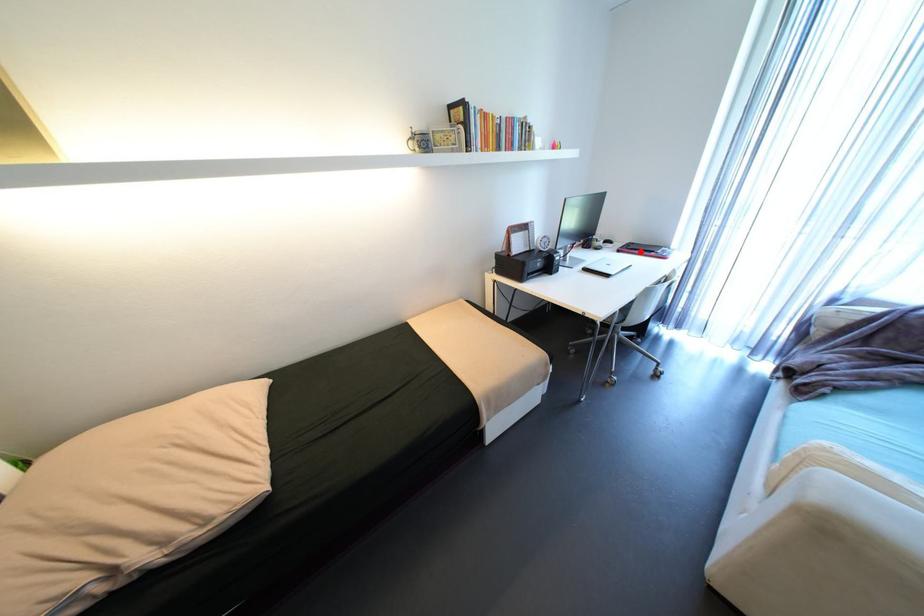
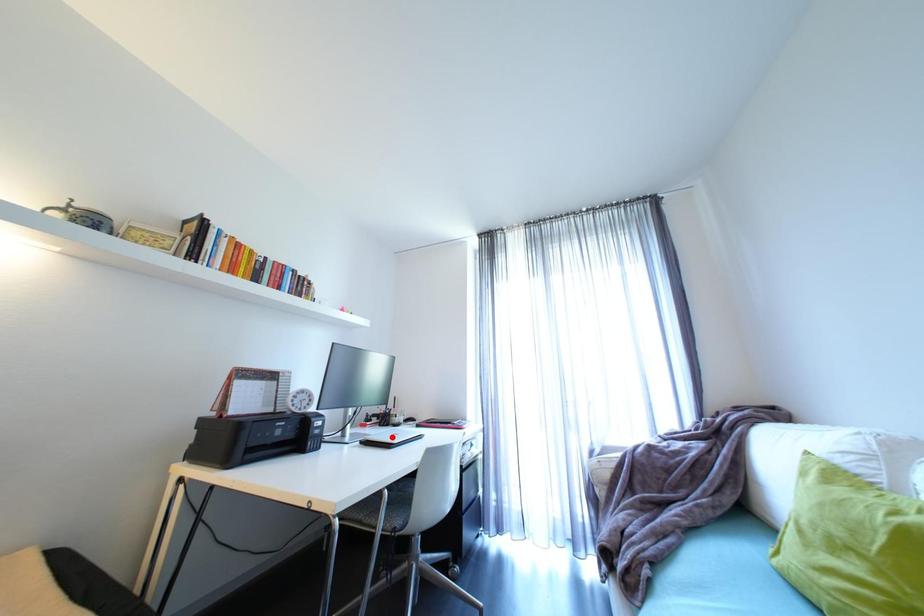
I am providing you with two images of the same scene from different viewpoints. A red point is marked on the first image and another point is marked on the second image. Do the highlighted points in image1 and image2 indicate the same real-world spot?

No